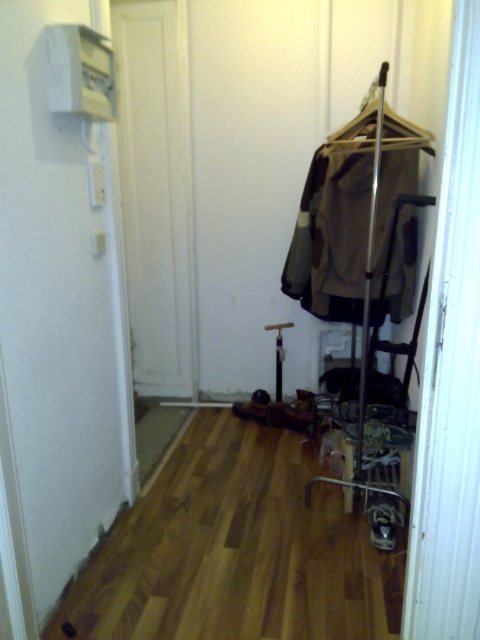
Question: Which point is closer to the camera?

Choices:
 (A) natural wood floor at lower center
 (B) matte brown coat rack at center

Answer: (A)

Question: Is matte brown coat rack at center further to the viewer compared to metallic silver hanger at upper center?

Choices:
 (A) no
 (B) yes

Answer: (B)

Question: Which object is the farthest from the natural wood floor at lower center?

Choices:
 (A) matte brown coat rack at center
 (B) brown fabric coat at center

Answer: (A)

Question: Which object is farther from the camera taking this photo?

Choices:
 (A) matte brown coat rack at center
 (B) brown fabric coat at center
 (C) natural wood floor at lower center

Answer: (A)

Question: Is matte brown coat rack at center thinner than metallic silver hanger at upper center?

Choices:
 (A) yes
 (B) no

Answer: (B)

Question: Is natural wood floor at lower center smaller than metallic silver hanger at upper center?

Choices:
 (A) no
 (B) yes

Answer: (A)